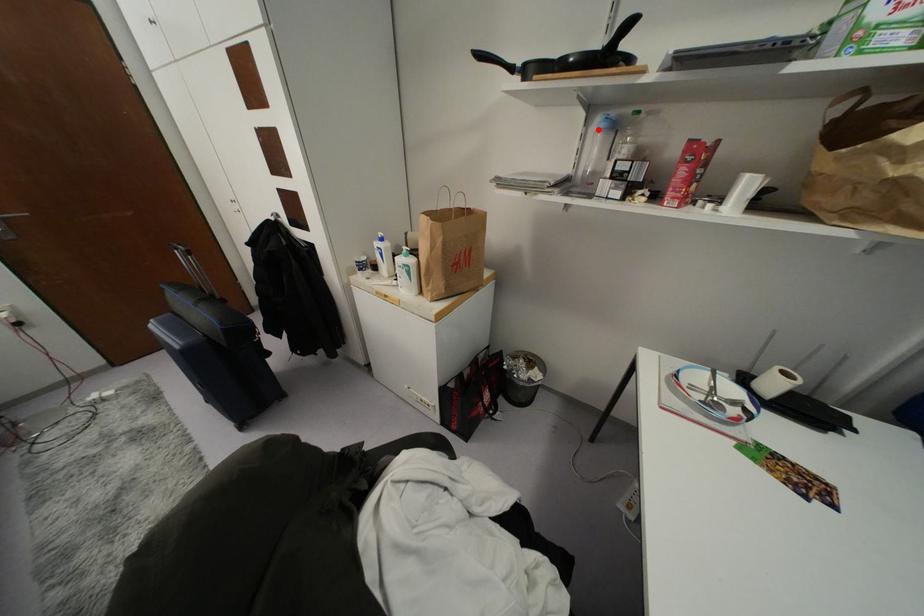
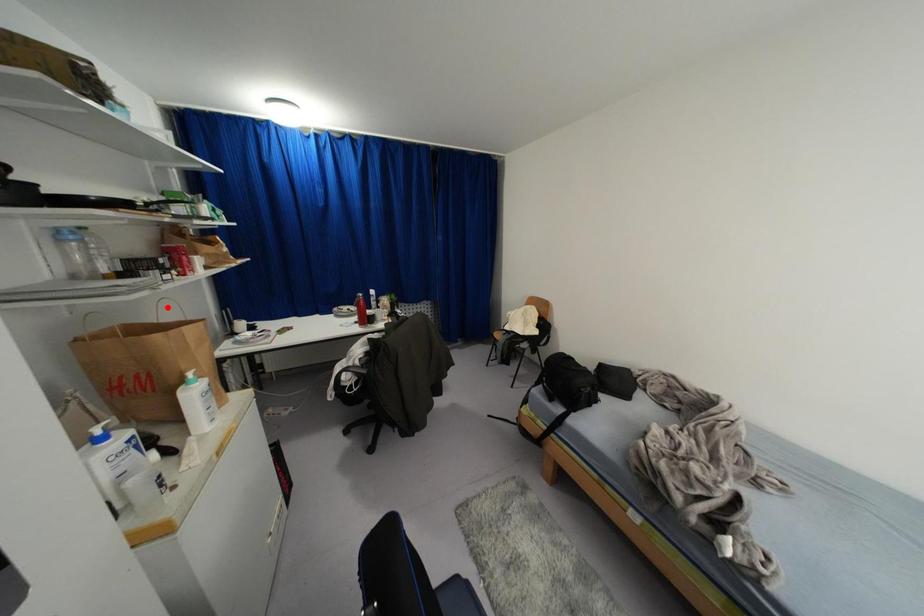
I am providing you with two images of the same scene from different viewpoints. A red point is marked on the first image and another point is marked on the second image. Does the point marked in image1 correspond to the same location as the one in image2?

No